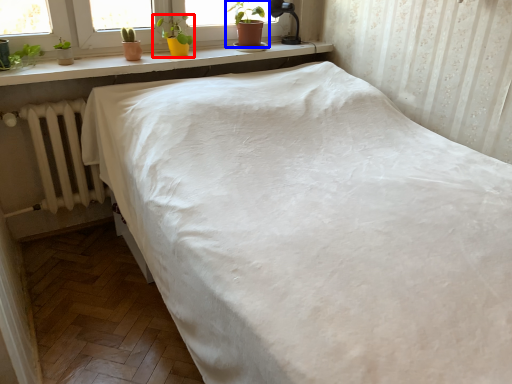
Question: Which object is closer to the camera taking this photo, houseplant (highlighted by a red box) or houseplant (highlighted by a blue box)?

Choices:
 (A) houseplant
 (B) houseplant

Answer: (A)